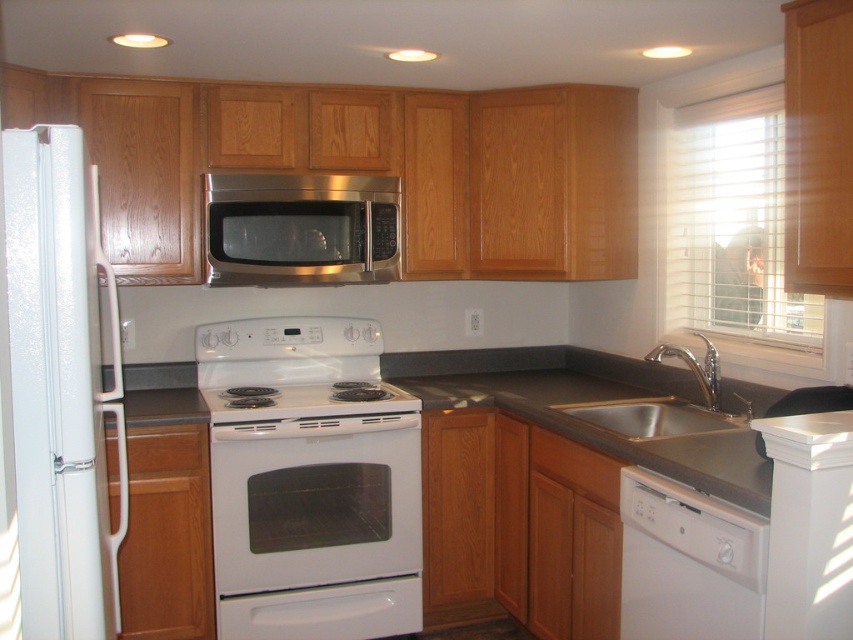
You are a chef preparing to clean the kitchen appliances. You need to access the stainless steel microwave at center. Is the white glossy oven at center blocking your access to it?

The white glossy oven at center is in front of the stainless steel microwave at center, so yes, the oven is blocking access to the microwave.

You are standing in the kitchen and want to wash dishes. The silver metallic sink at lower right and the white glossy stove at center are both in your line of sight. Which object is physically nearer to you?

The silver metallic sink at lower right is closer to the viewer than the white glossy stove at center.